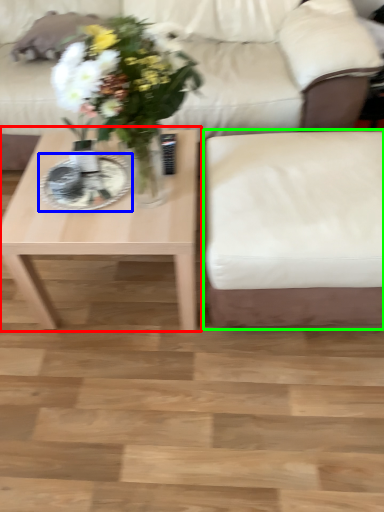
Question: Based on their relative distances, which object is farther from coffee table (highlighted by a red box)? Choose from plate (highlighted by a blue box) and armchair (highlighted by a green box).

Choices:
 (A) plate
 (B) armchair

Answer: (B)